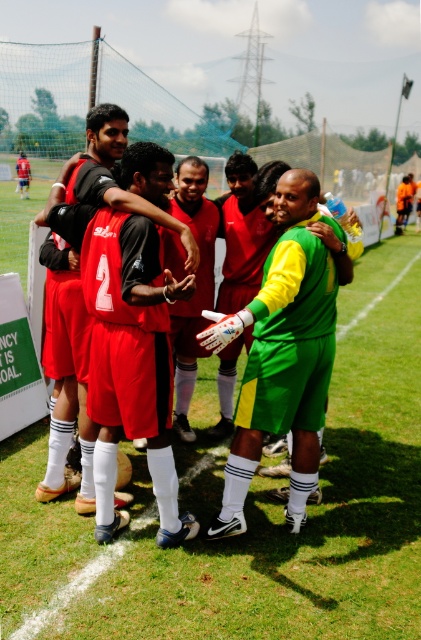
Question: Can you confirm if matte red shorts at center is positioned to the left of green matte jersey at center?

Choices:
 (A) yes
 (B) no

Answer: (A)

Question: Among these objects, which one is farthest from the camera?

Choices:
 (A) matte red shorts at center
 (B) green matte jersey at center

Answer: (B)

Question: Observing the image, what is the correct spatial positioning of matte red shorts at center in reference to green matte jersey at center?

Choices:
 (A) above
 (B) below

Answer: (A)

Question: Which point is farther from the camera taking this photo?

Choices:
 (A) (269, 328)
 (B) (125, 317)

Answer: (A)

Question: Does matte red shorts at center appear under green matte jersey at center?

Choices:
 (A) yes
 (B) no

Answer: (B)